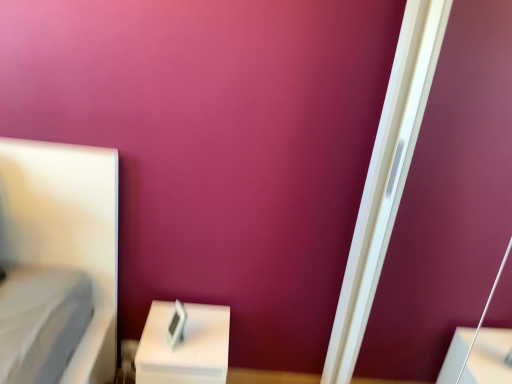
Question: Would you say white glossy screen door at right is part of white plastic clock at lower center's contents?

Choices:
 (A) no
 (B) yes

Answer: (A)

Question: Does white plastic clock at lower center appear on the right side of white glossy screen door at right?

Choices:
 (A) no
 (B) yes

Answer: (A)

Question: Is white plastic clock at lower center beside white glossy screen door at right?

Choices:
 (A) yes
 (B) no

Answer: (B)

Question: Is the position of white plastic clock at lower center less distant than that of white glossy screen door at right?

Choices:
 (A) no
 (B) yes

Answer: (A)

Question: Is white plastic clock at lower center positioned behind white glossy screen door at right?

Choices:
 (A) no
 (B) yes

Answer: (B)

Question: From the image's perspective, is white plastic clock at lower center located above white glossy screen door at right?

Choices:
 (A) yes
 (B) no

Answer: (B)

Question: Can you confirm if white glossy screen door at right is positioned to the left of white plastic clock at lower center?

Choices:
 (A) yes
 (B) no

Answer: (B)

Question: Can you confirm if white glossy screen door at right is smaller than white plastic clock at lower center?

Choices:
 (A) yes
 (B) no

Answer: (B)

Question: Is white glossy screen door at right shorter than white plastic clock at lower center?

Choices:
 (A) no
 (B) yes

Answer: (A)

Question: Considering the relative positions of white glossy screen door at right and white plastic clock at lower center in the image provided, is white glossy screen door at right to the right of white plastic clock at lower center from the viewer's perspective?

Choices:
 (A) no
 (B) yes

Answer: (B)

Question: Is white glossy screen door at right oriented towards white plastic clock at lower center?

Choices:
 (A) yes
 (B) no

Answer: (A)

Question: Is white glossy screen door at right facing away from white plastic clock at lower center?

Choices:
 (A) yes
 (B) no

Answer: (B)

Question: Is white plastic clock at lower center to the left or to the right of white glossy screen door at right in the image?

Choices:
 (A) right
 (B) left

Answer: (B)